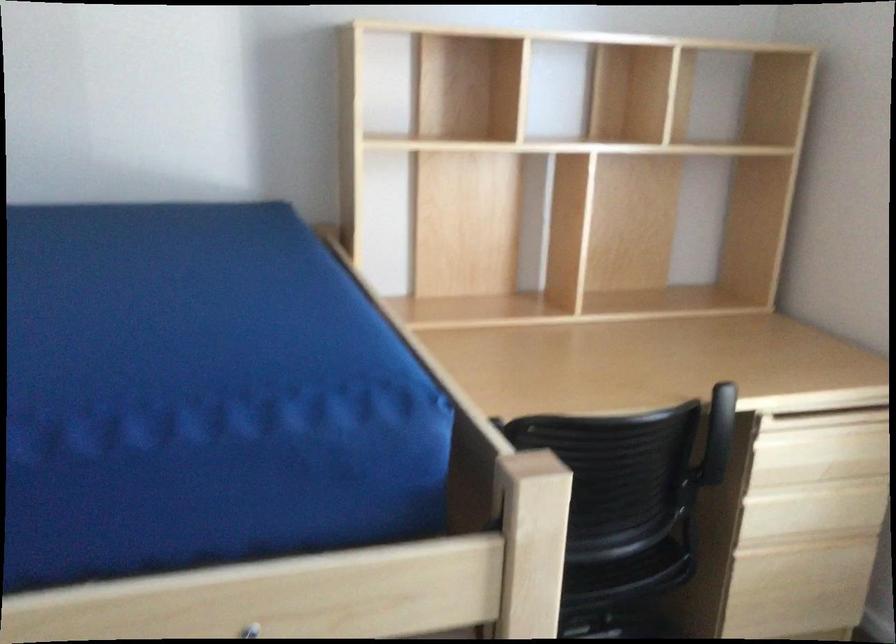
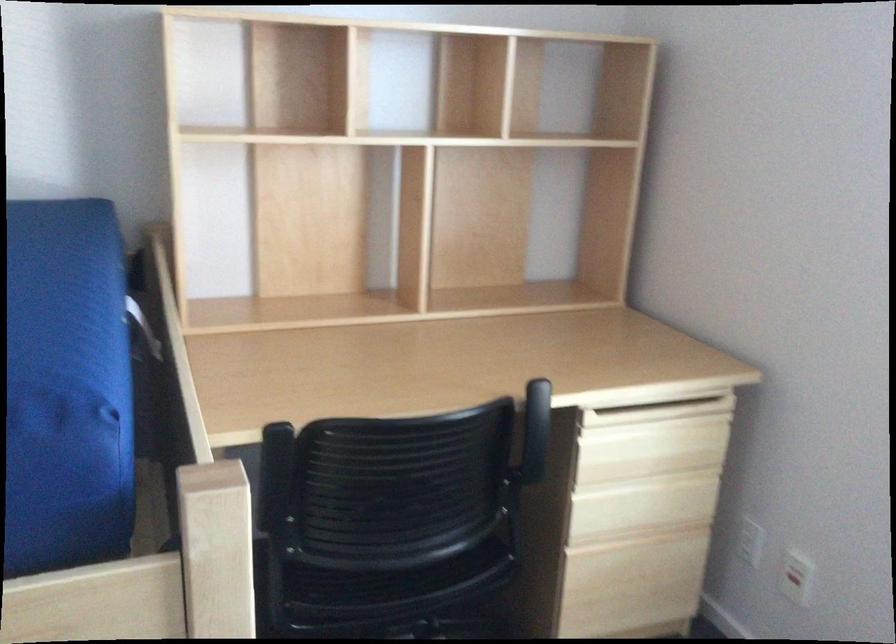
Locate, in the second image, the point that corresponds to point 399,379 in the first image.

(66, 388)